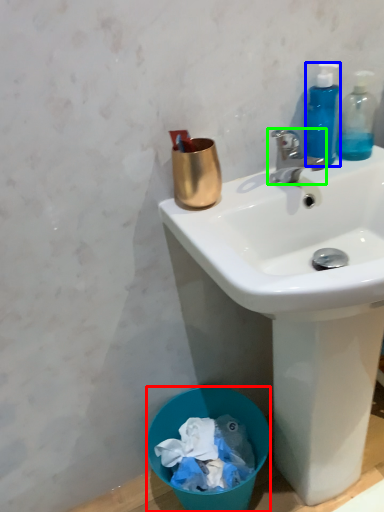
Question: Which is farther away from trash bin/can (highlighted by a red box)? bottle (highlighted by a blue box) or faucet (highlighted by a green box)?

Choices:
 (A) bottle
 (B) faucet

Answer: (A)